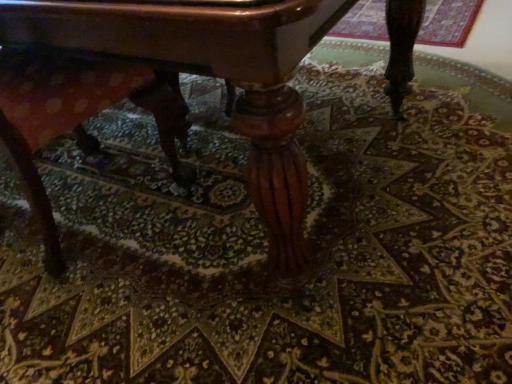
Question: Considering the relative sizes of polished wood table at center and wooden swivel chair at lower left in the image provided, is polished wood table at center smaller than wooden swivel chair at lower left?

Choices:
 (A) no
 (B) yes

Answer: (A)

Question: From the image's perspective, is polished wood table at center below wooden swivel chair at lower left?

Choices:
 (A) yes
 (B) no

Answer: (B)

Question: Considering the relative sizes of polished wood table at center and wooden swivel chair at lower left in the image provided, is polished wood table at center shorter than wooden swivel chair at lower left?

Choices:
 (A) yes
 (B) no

Answer: (B)

Question: Is polished wood table at center bigger than wooden swivel chair at lower left?

Choices:
 (A) no
 (B) yes

Answer: (B)

Question: Is polished wood table at center aimed at wooden swivel chair at lower left?

Choices:
 (A) no
 (B) yes

Answer: (B)

Question: Are polished wood table at center and wooden swivel chair at lower left located far from each other?

Choices:
 (A) yes
 (B) no

Answer: (B)

Question: Does wooden swivel chair at lower left have a smaller size compared to polished wood table at center?

Choices:
 (A) yes
 (B) no

Answer: (A)

Question: From a real-world perspective, is wooden swivel chair at lower left positioned under polished wood table at center based on gravity?

Choices:
 (A) yes
 (B) no

Answer: (A)

Question: Does wooden swivel chair at lower left appear on the right side of polished wood table at center?

Choices:
 (A) yes
 (B) no

Answer: (B)

Question: Is wooden swivel chair at lower left at the left side of polished wood table at center?

Choices:
 (A) no
 (B) yes

Answer: (B)

Question: Is wooden swivel chair at lower left touching polished wood table at center?

Choices:
 (A) yes
 (B) no

Answer: (B)

Question: Does wooden swivel chair at lower left turn towards polished wood table at center?

Choices:
 (A) no
 (B) yes

Answer: (B)

Question: Looking at their shapes, would you say polished wood table at center is wider or thinner than wooden swivel chair at lower left?

Choices:
 (A) wide
 (B) thin

Answer: (A)